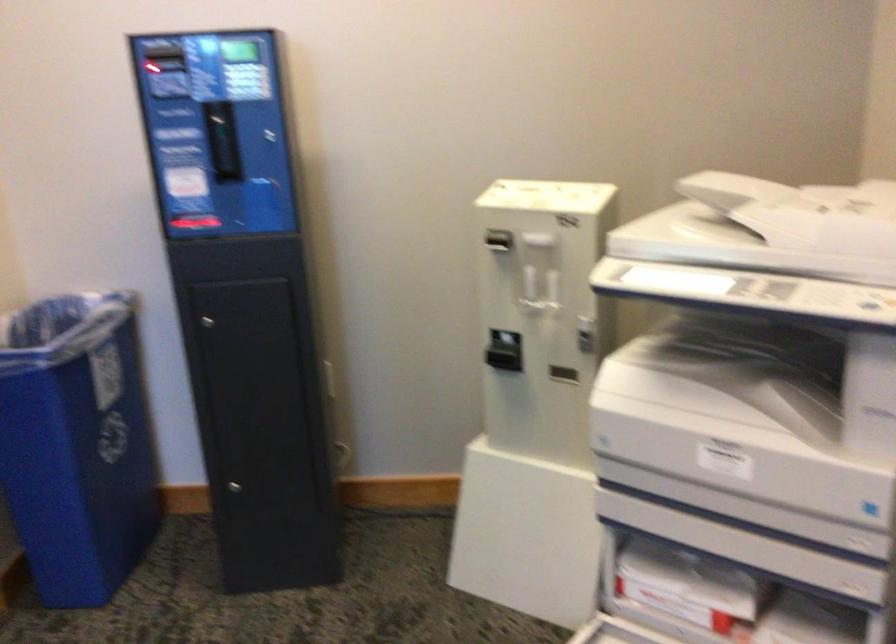
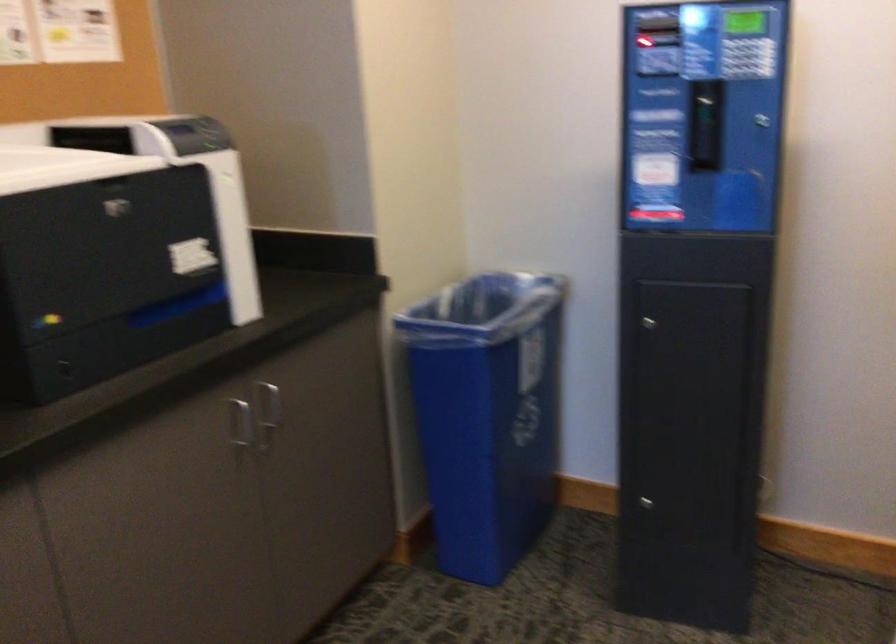
Question: The camera is either moving clockwise (left) or counter-clockwise (right) around the object. The first image is from the beginning of the video and the second image is from the end. Is the camera moving left or right when shooting the video?

Choices:
 (A) Left
 (B) Right

Answer: (B)